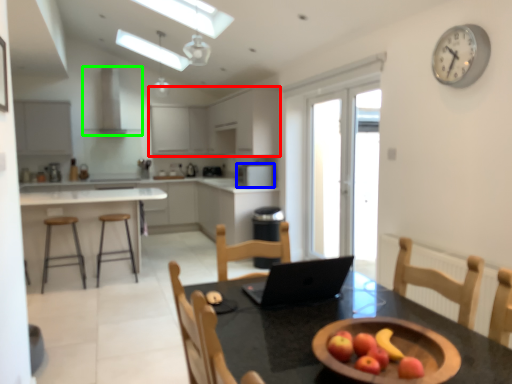
Question: Which object is positioned closest to cabinetry (highlighted by a red box)? Select from kitchen appliance (highlighted by a blue box) and exhaust hood (highlighted by a green box).

Choices:
 (A) kitchen appliance
 (B) exhaust hood

Answer: (B)